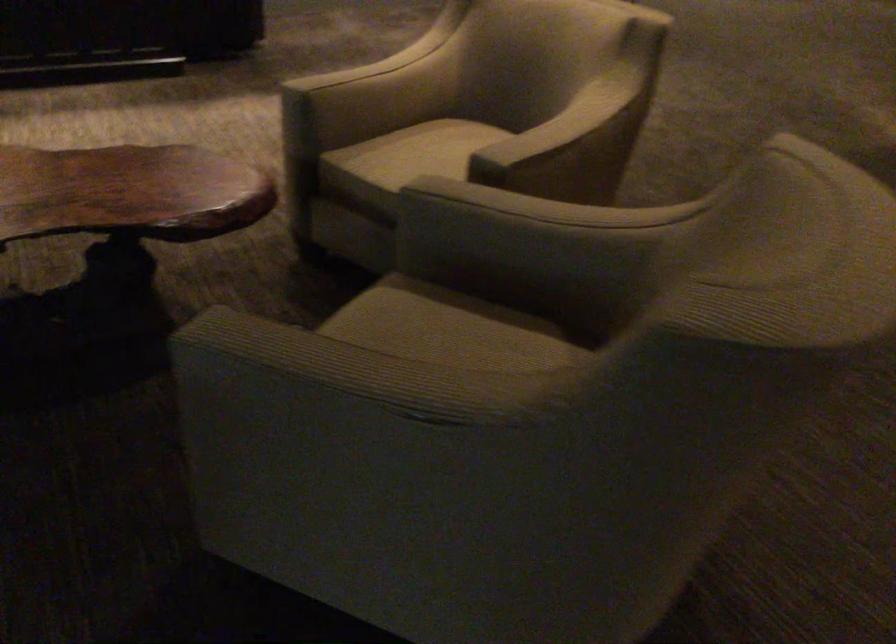
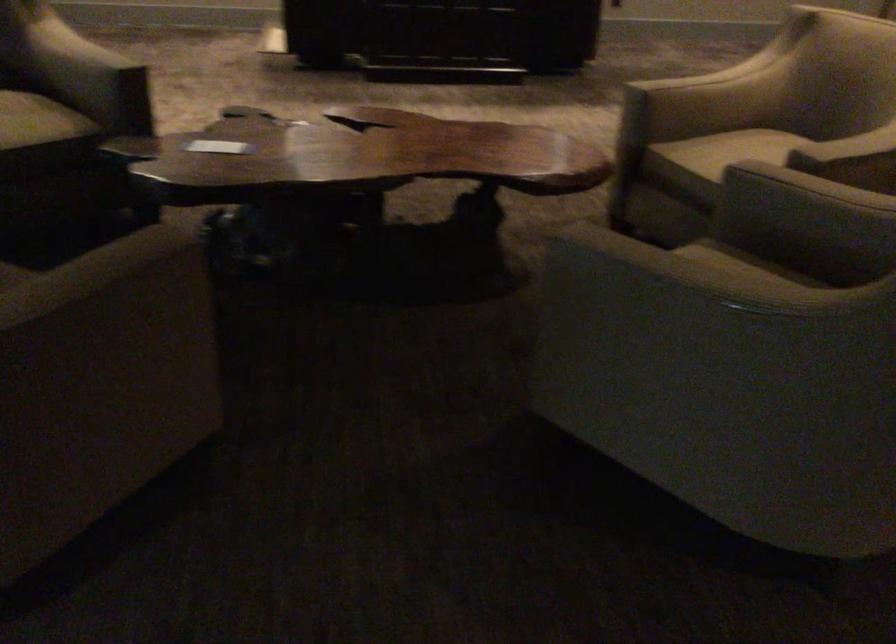
Question: In a continuous first-person perspective shot, in which direction is the camera moving?

Choices:
 (A) Left
 (B) Right
 (C) Forward
 (D) Backward

Answer: (D)